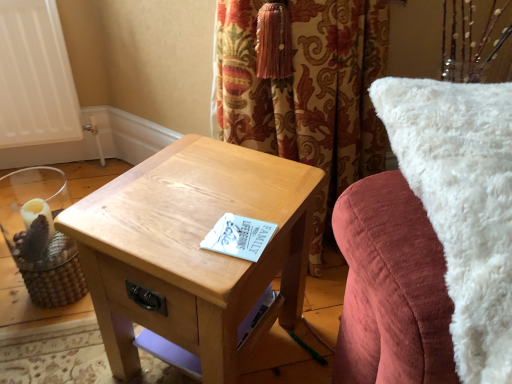
Question: Is white fluffy pillow at upper right spatially inside light brown wood table at center, or outside of it?

Choices:
 (A) inside
 (B) outside

Answer: (B)

Question: Looking at the image, does white fluffy pillow at upper right seem bigger or smaller compared to light brown wood table at center?

Choices:
 (A) big
 (B) small

Answer: (A)

Question: Estimate the real-world distances between objects in this image. Which object is farther from the woven wood candle holder at left?

Choices:
 (A) white fluffy pillow at upper right
 (B) light brown wood table at center

Answer: (A)

Question: Estimate the real-world distances between objects in this image. Which object is farther from the light brown wood table at center?

Choices:
 (A) white fluffy pillow at upper right
 (B) woven wood candle holder at left

Answer: (B)